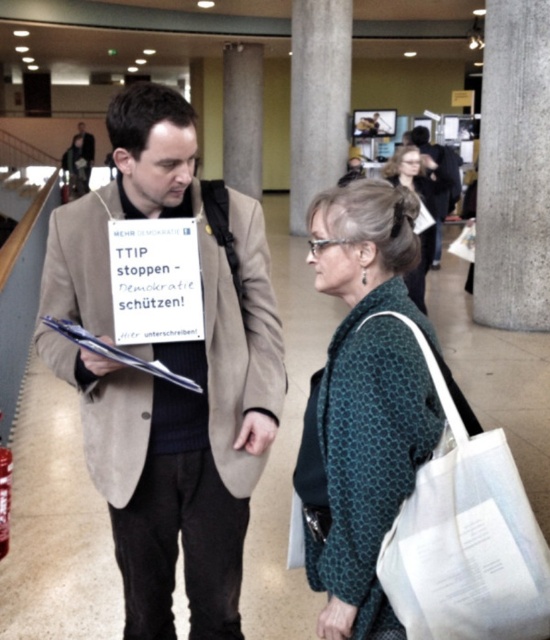
Question: Which point appears farthest from the camera in this image?

Choices:
 (A) (408, 173)
 (B) (84, 141)

Answer: (B)

Question: Is suede beige coat at center positioned before teal dotted sweater at center?

Choices:
 (A) no
 (B) yes

Answer: (A)

Question: Which of the following is the farthest from the observer?

Choices:
 (A) (410, 557)
 (B) (366, 512)

Answer: (B)

Question: Can you confirm if teal dotted scarf at center is positioned to the right of dark brown leather jacket at upper right?

Choices:
 (A) yes
 (B) no

Answer: (B)

Question: Can you confirm if teal dotted sweater at center is smaller than dark gray suit at upper left?

Choices:
 (A) no
 (B) yes

Answer: (B)

Question: Which of the following is the closest to the observer?

Choices:
 (A) (316, 442)
 (B) (79, 134)
 (C) (221, 614)

Answer: (A)